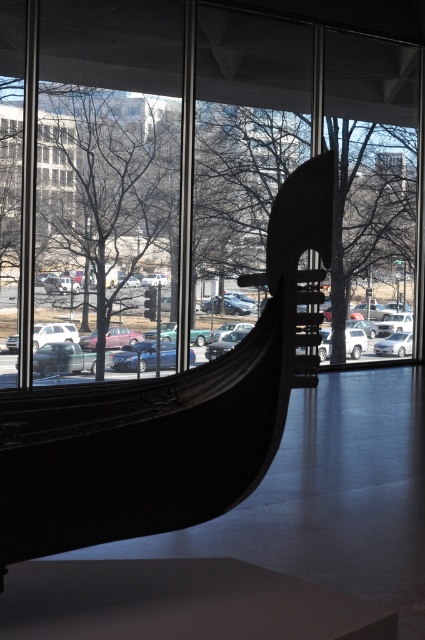
You are a delivery person who needs to park your van between the black polished wood boat at center and the white matte car at left. Can you fit your van there?

The black polished wood boat at center is to the right of white matte car at left, so there is space between them. However, since the exact distance isn not provided, it is uncertain if the van can fit. Please check the available space physically.

You are standing inside a modern building and looking through the large windows. You notice a point marked at coordinates (169, 413). What object is located at this point?

The point at coordinates (169, 413) marks the location of the black polished wood boat at center.

You are standing inside the building looking through the window. You see the black polished wood boat at center and the white matte car at left. Which object is closer to you?

The black polished wood boat at center is closer to you because it is in front of the white matte car at left.